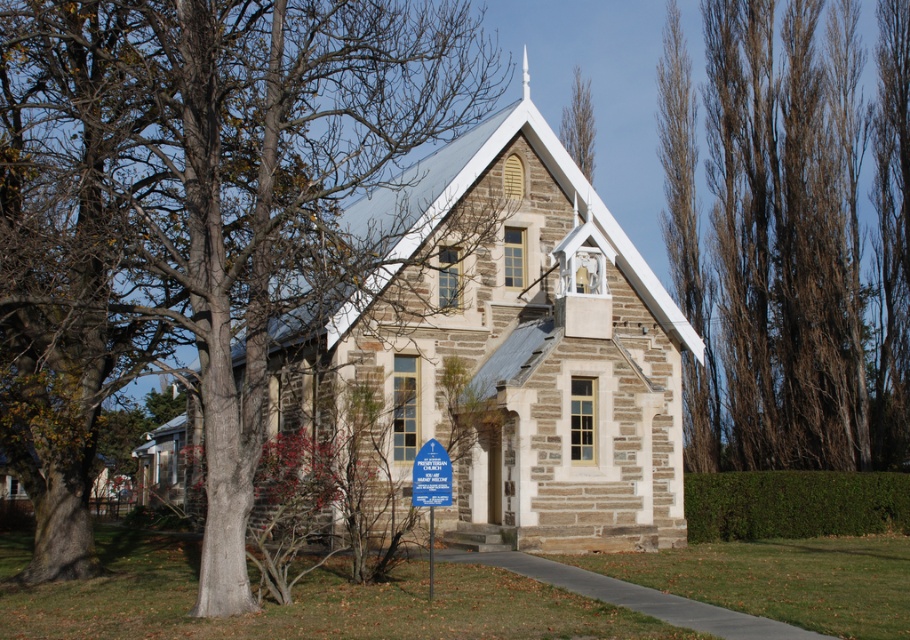
Is brown bark tree at left to the left of brown bark tree at upper right from the viewer's perspective?

Indeed, brown bark tree at left is positioned on the left side of brown bark tree at upper right.

The height and width of the screenshot is (640, 910). In order to click on brown bark tree at left in this screenshot , I will do `click(191, 216)`.

Who is higher up, brown bark tree at left or brown textured tree at upper center?

brown textured tree at upper center

Can you confirm if brown bark tree at left is bigger than brown textured tree at upper center?

Indeed, brown bark tree at left has a larger size compared to brown textured tree at upper center.

Between point (221, 205) and point (579, 120), which one is positioned behind?

Positioned behind is point (579, 120).

I want to click on brown bark tree at left, so click(191, 216).

Is point (723, 74) farther from camera compared to point (587, 122)?

No, it is not.

The height and width of the screenshot is (640, 910). I want to click on brown bark tree at upper right, so click(802, 243).